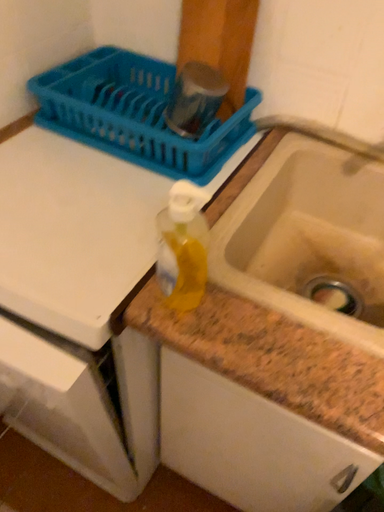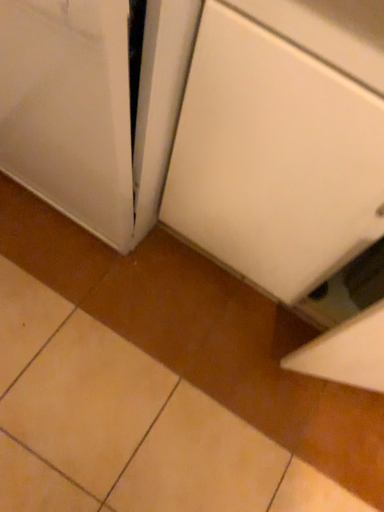
Question: How did the camera likely rotate when shooting the video?

Choices:
 (A) rotated upward
 (B) rotated downward

Answer: (B)